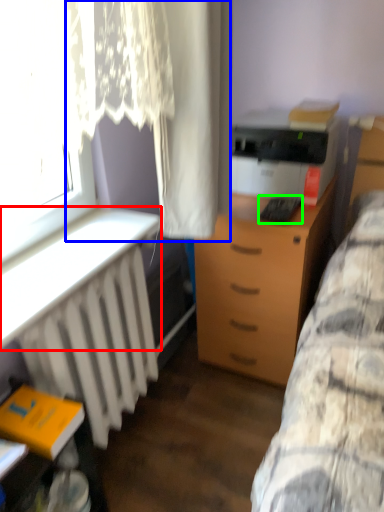
Question: Based on their relative distances, which object is farther from table (highlighted by a red box)? Choose from curtain (highlighted by a blue box) and equipment (highlighted by a green box).

Choices:
 (A) curtain
 (B) equipment

Answer: (B)